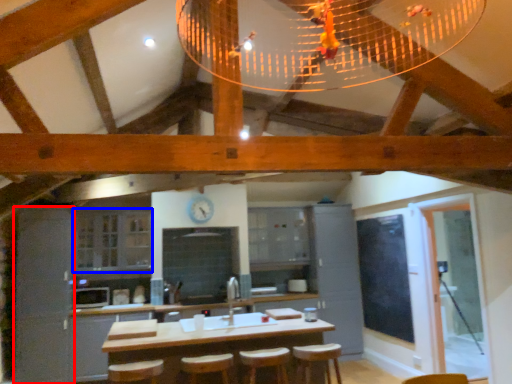
Question: Which of the following is the farthest to the observer, cabinetry (highlighted by a red box) or cabinetry (highlighted by a blue box)?

Choices:
 (A) cabinetry
 (B) cabinetry

Answer: (B)